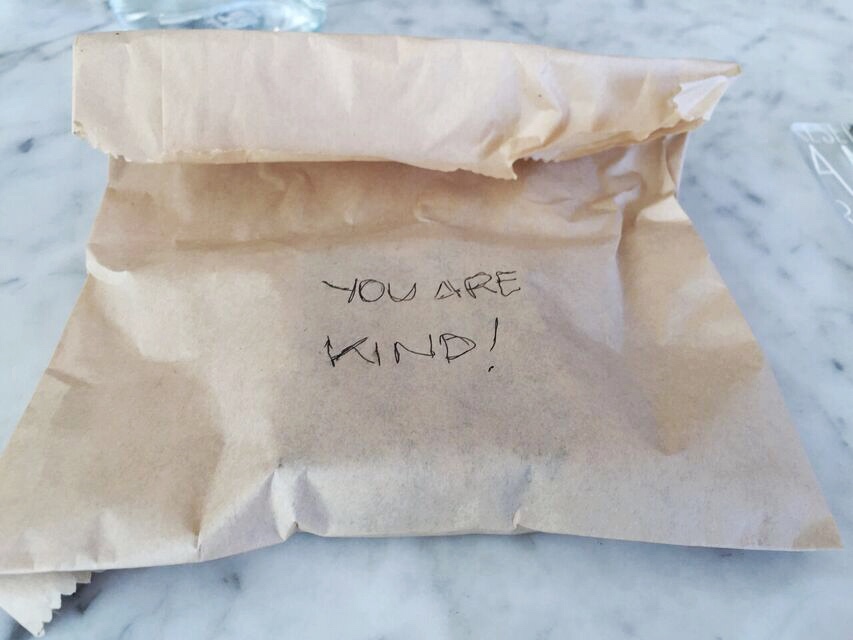
Where is `countertop surface`? This screenshot has width=853, height=640. countertop surface is located at coordinates (374, 612).